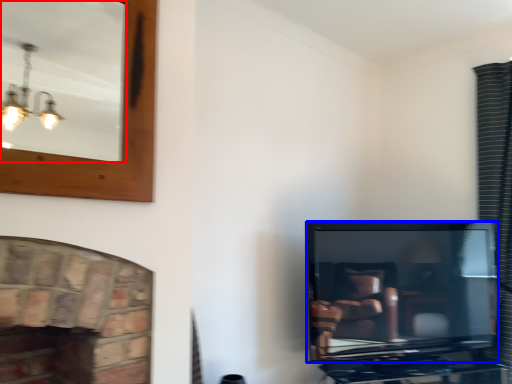
Question: Which point is closer to the camera, mirror (highlighted by a red box) or television (highlighted by a blue box)?

Choices:
 (A) mirror
 (B) television

Answer: (A)